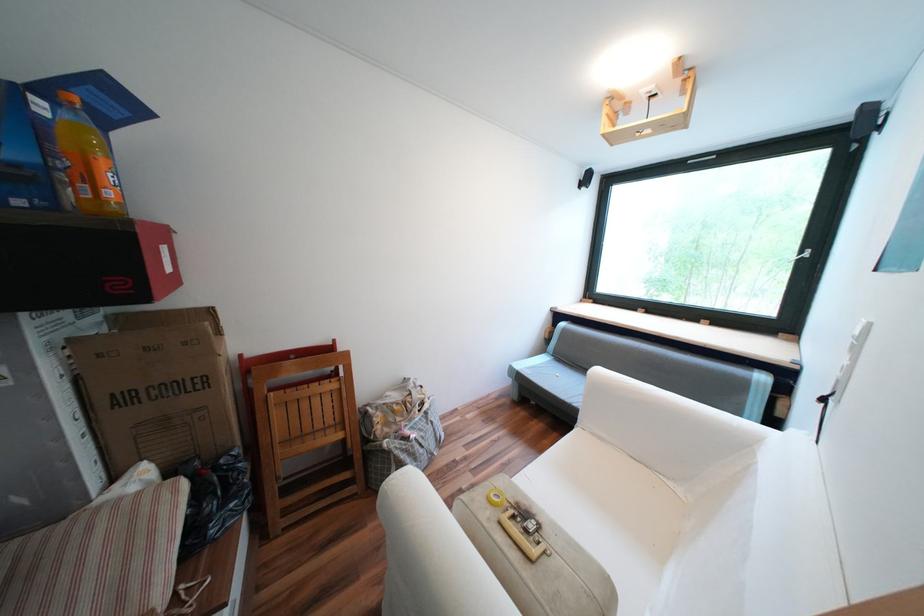
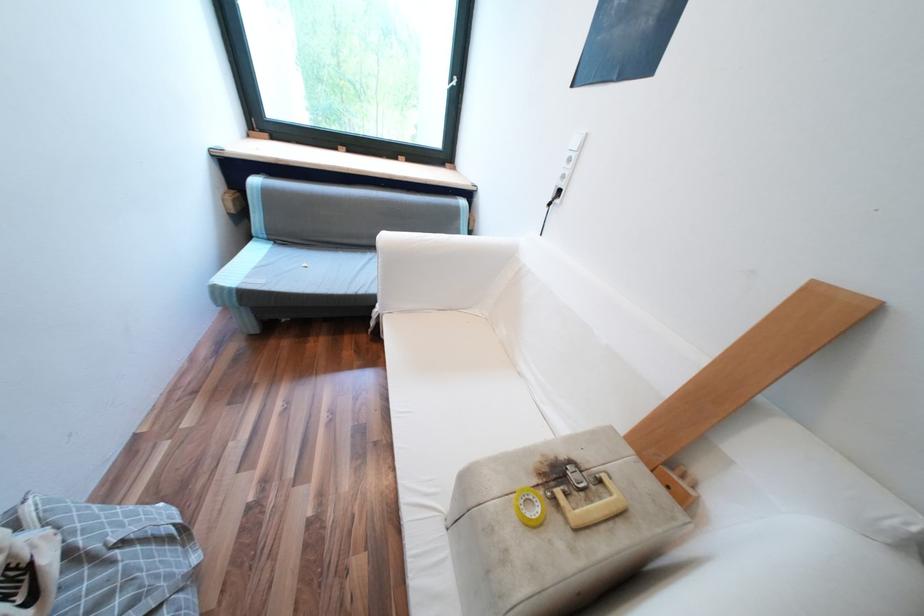
How did the camera likely rotate?

The camera rotated toward right-down.